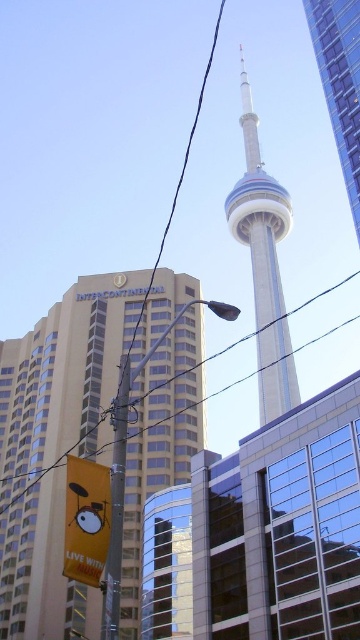
Question: Can you confirm if white glass tower at center is positioned below yellow matte banner at lower left?

Choices:
 (A) yes
 (B) no

Answer: (B)

Question: Based on their relative distances, which object is farther from the white glass tower at center?

Choices:
 (A) silver metallic cn tower at center
 (B) metallic pole at left
 (C) black wire at upper center
 (D) yellow matte banner at lower left

Answer: (D)

Question: Which point appears farthest from the camera in this image?

Choices:
 (A) (164, 237)
 (B) (357, 145)

Answer: (A)

Question: Does yellow matte banner at lower left have a greater width compared to metallic pole at left?

Choices:
 (A) no
 (B) yes

Answer: (A)

Question: Can you confirm if white glass tower at center is thinner than yellow matte banner at lower left?

Choices:
 (A) yes
 (B) no

Answer: (B)

Question: Estimate the real-world distances between objects in this image. Which object is closer to the yellow matte banner at lower left?

Choices:
 (A) beige glass building at center
 (B) metallic pole at left

Answer: (B)